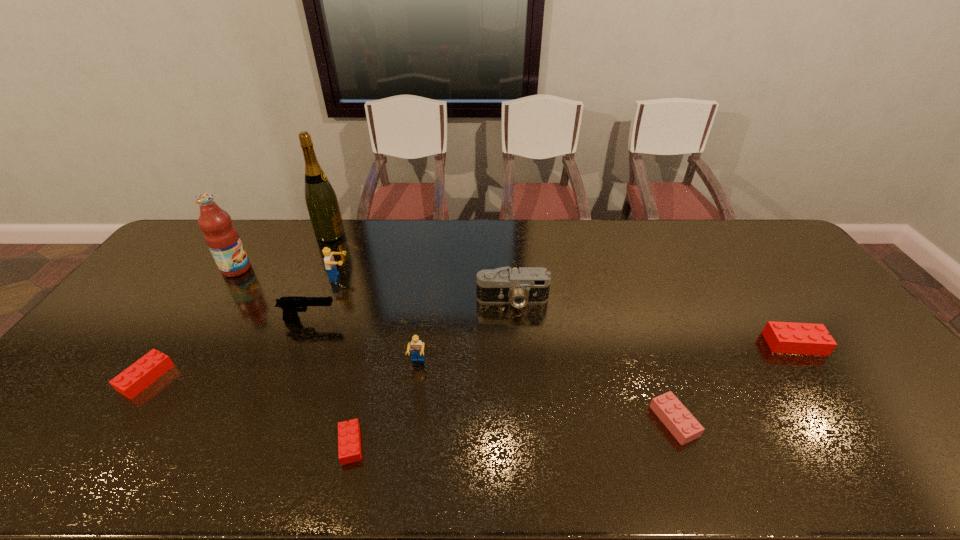
Find the location of a particular element. This screenshot has height=540, width=960. the tallest object is located at coordinates (321, 201).

You are a GUI agent. You are given a task and a screenshot of the screen. Output one action in this format:
    pyautogui.click(x=<x>, y=<y>)
    Task: Click on the farthest object
    This screenshot has height=540, width=960.
    Given the screenshot: What is the action you would take?
    pyautogui.click(x=321, y=201)

The height and width of the screenshot is (540, 960). In order to click on the ninth shortest object in this screenshot , I will do 223,240.

Locate an element on the screen. the bigger blue Lego is located at coordinates (330, 264).

I want to click on the second Lego from left to right, so click(330, 264).

Where is `the third object from right to left`? the third object from right to left is located at coordinates click(x=527, y=285).

Identify the location of the seventh nearest object. The height and width of the screenshot is (540, 960). (527, 285).

Where is `the fifth farthest object`? The height and width of the screenshot is (540, 960). the fifth farthest object is located at coordinates (290, 305).

Locate an element on the screen. pistol is located at coordinates tap(290, 305).

This screenshot has height=540, width=960. Identify the location of the smaller blue Lego. (416, 346).